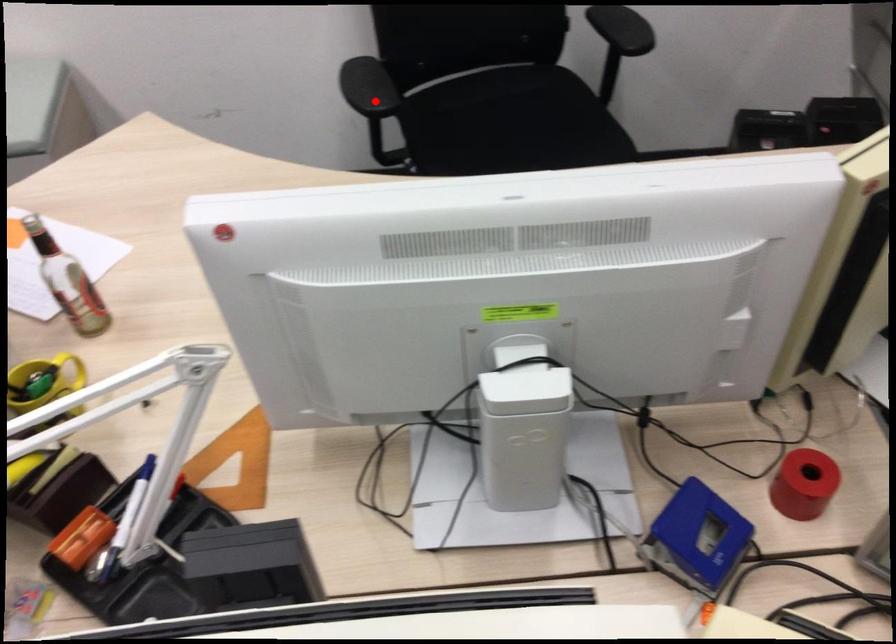
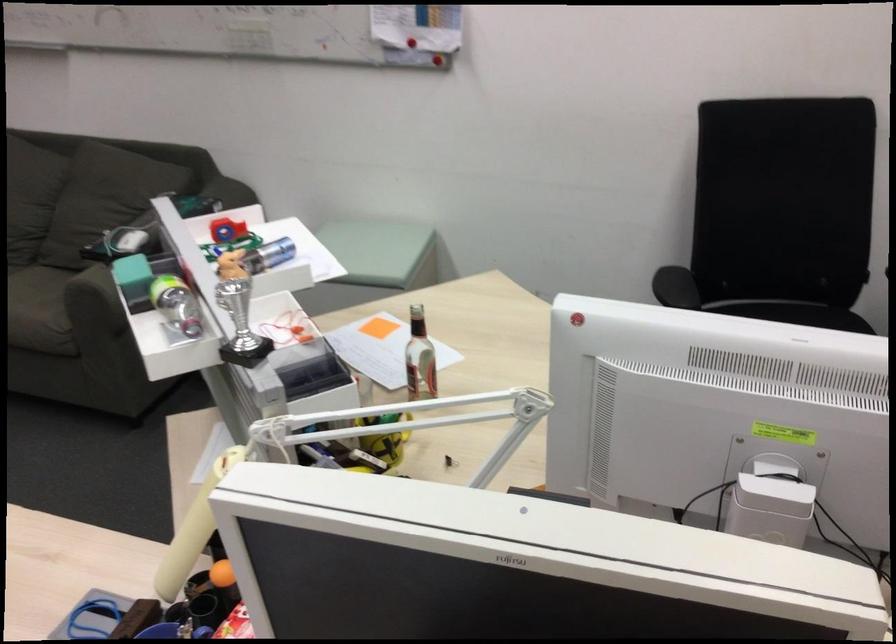
Find the pixel in the second image that matches the highlighted location in the first image.

(675, 287)